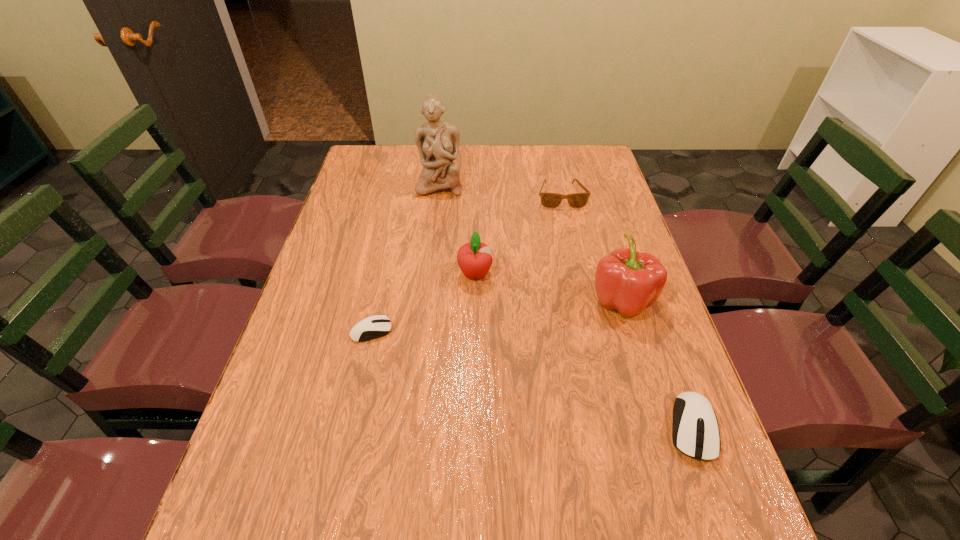
Locate an element on the screen. The height and width of the screenshot is (540, 960). pepper at the right edge is located at coordinates (626, 280).

The image size is (960, 540). I want to click on object positioned at the near right corner, so click(695, 432).

In the image, there is a desktop. At what (x,y) coordinates should I click in order to perform the action: click on vacant space at the far edge. Please return your answer as a coordinate pair (x, y). Looking at the image, I should click on (528, 147).

In order to click on free region at the left edge of the desktop in this screenshot , I will do `click(352, 220)`.

The image size is (960, 540). Find the location of `vacant space at the far left corner of the desktop`. vacant space at the far left corner of the desktop is located at coordinates (374, 161).

The height and width of the screenshot is (540, 960). In order to click on vacant space at the far right corner in this screenshot , I will do `click(602, 173)`.

Locate an element on the screen. This screenshot has width=960, height=540. vacant area between the fifth shortest object and the nearer mouse is located at coordinates (657, 363).

I want to click on vacant space that is in between the shorter mouse and the fifth shortest object, so click(496, 315).

Where is `free space that is in between the taller mouse and the fifth shortest object`? This screenshot has width=960, height=540. free space that is in between the taller mouse and the fifth shortest object is located at coordinates (657, 363).

The height and width of the screenshot is (540, 960). Find the location of `vacant space that is in between the figurine and the sunglasses`. vacant space that is in between the figurine and the sunglasses is located at coordinates (500, 191).